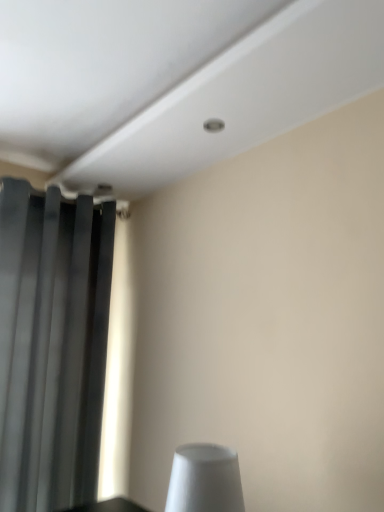
Question: Can you confirm if dark gray matte curtain at left is thinner than white matte cone at lower center?

Choices:
 (A) yes
 (B) no

Answer: (A)

Question: Is the position of dark gray matte curtain at left less distant than that of white matte cone at lower center?

Choices:
 (A) yes
 (B) no

Answer: (B)

Question: Does dark gray matte curtain at left have a greater height compared to white matte cone at lower center?

Choices:
 (A) yes
 (B) no

Answer: (A)

Question: Is dark gray matte curtain at left oriented towards white matte cone at lower center?

Choices:
 (A) no
 (B) yes

Answer: (B)

Question: Is the depth of dark gray matte curtain at left greater than that of white matte cone at lower center?

Choices:
 (A) yes
 (B) no

Answer: (A)

Question: Is white matte cone at lower center at the back of dark gray matte curtain at left?

Choices:
 (A) no
 (B) yes

Answer: (A)

Question: From a real-world perspective, is white matte cone at lower center located beneath dark gray matte curtain at left?

Choices:
 (A) yes
 (B) no

Answer: (A)

Question: Does white matte cone at lower center turn towards dark gray matte curtain at left?

Choices:
 (A) no
 (B) yes

Answer: (A)

Question: Is white matte cone at lower center wider than dark gray matte curtain at left?

Choices:
 (A) no
 (B) yes

Answer: (B)

Question: Can you confirm if white matte cone at lower center is shorter than dark gray matte curtain at left?

Choices:
 (A) yes
 (B) no

Answer: (A)

Question: Does white matte cone at lower center have a greater height compared to dark gray matte curtain at left?

Choices:
 (A) no
 (B) yes

Answer: (A)

Question: Can you confirm if white matte cone at lower center is positioned to the right of dark gray matte curtain at left?

Choices:
 (A) no
 (B) yes

Answer: (B)

Question: Is dark gray matte curtain at left situated inside white matte cone at lower center or outside?

Choices:
 (A) outside
 (B) inside

Answer: (A)